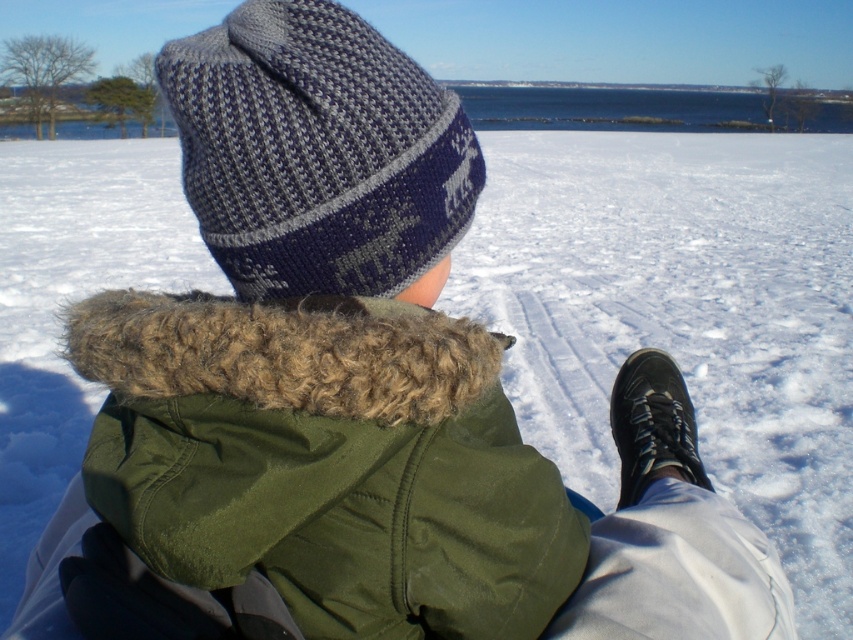
Question: Can you confirm if olive green fabric jacket at center is smaller than knitted woolen hat at upper center?

Choices:
 (A) yes
 (B) no

Answer: (A)

Question: Which object is closer to the camera taking this photo?

Choices:
 (A) olive green fabric jacket at center
 (B) knitted woolen hat at upper center

Answer: (A)

Question: Does olive green fabric jacket at center appear on the right side of knitted woolen hat at upper center?

Choices:
 (A) no
 (B) yes

Answer: (B)

Question: Which object is farther from the camera taking this photo?

Choices:
 (A) olive green fabric jacket at center
 (B) knitted woolen hat at upper center

Answer: (B)

Question: Does olive green fabric jacket at center appear over knitted woolen hat at upper center?

Choices:
 (A) yes
 (B) no

Answer: (B)